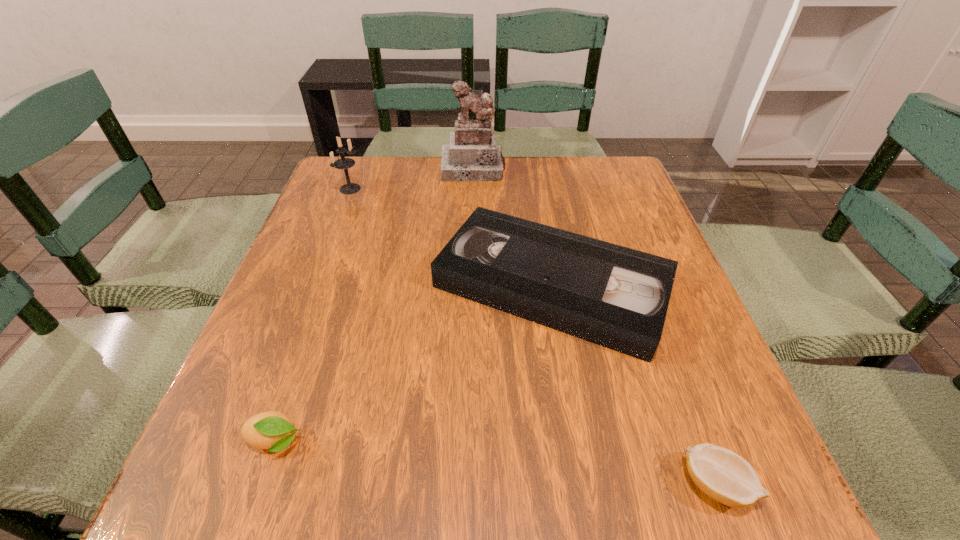
This screenshot has height=540, width=960. I want to click on free spot located on the left of the shortest object, so click(475, 484).

The image size is (960, 540). In order to click on figurine that is at the far edge in this screenshot , I will do `click(472, 155)`.

Where is `candle holder at the far edge`? The height and width of the screenshot is (540, 960). candle holder at the far edge is located at coordinates (344, 163).

Image resolution: width=960 pixels, height=540 pixels. Identify the location of candle holder that is at the left edge. (344, 163).

Identify the location of lemon present at the left edge. (271, 430).

Locate an element on the screen. This screenshot has height=540, width=960. videotape present at the right edge is located at coordinates (617, 297).

You are a GUI agent. You are given a task and a screenshot of the screen. Output one action in this format:
    pyautogui.click(x=<x>, y=<y>)
    Task: Click on the lemon located in the right edge section of the desktop
    
    Given the screenshot: What is the action you would take?
    pyautogui.click(x=724, y=476)

This screenshot has width=960, height=540. I want to click on object present at the far left corner, so click(x=344, y=163).

Identify the location of object present at the near left corner. (271, 430).

Identify the location of object situated at the near right corner. (724, 476).